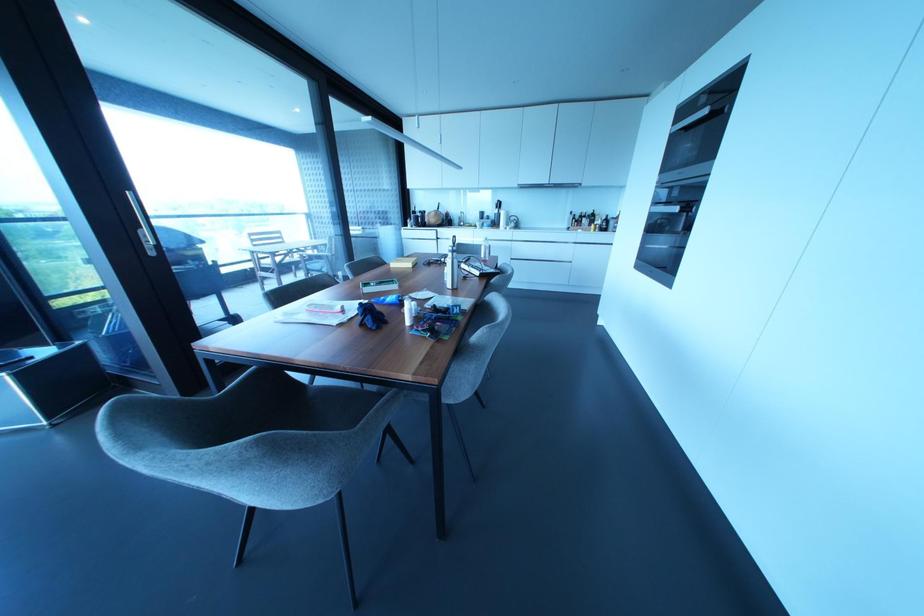
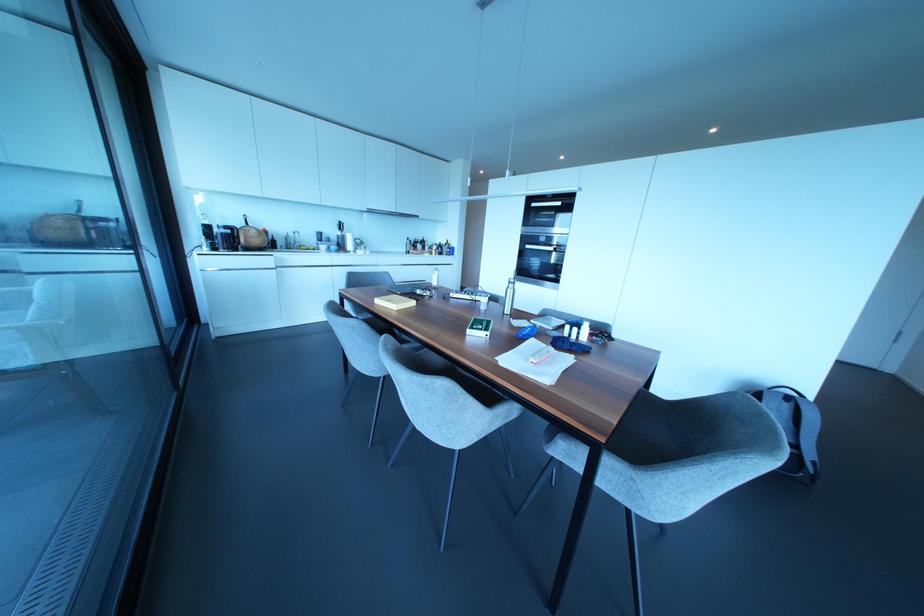
In the second image, find the point that corresponds to (520,185) in the first image.

(370, 209)